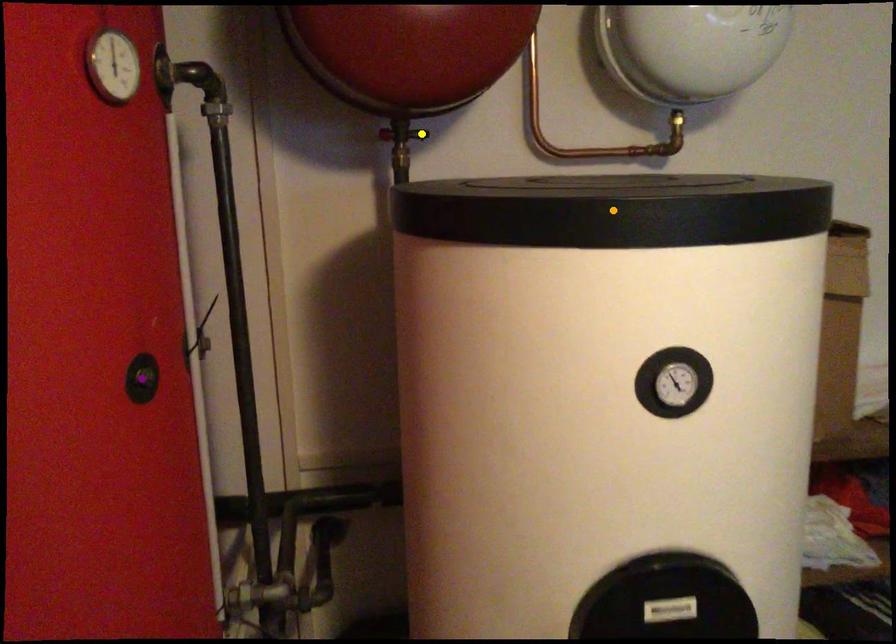
Order these from nearest to farthest:
A) purple point
B) yellow point
C) orange point

yellow point, purple point, orange point